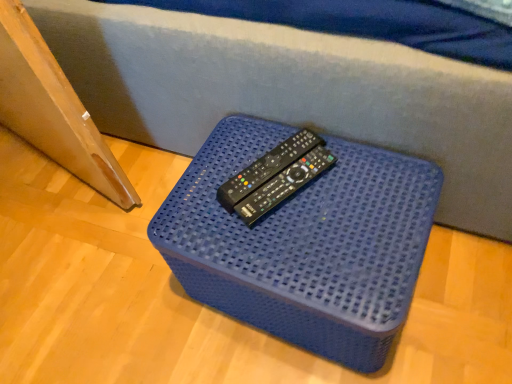
This screenshot has height=384, width=512. In order to click on free space that is to the left of black plastic remote at center in this screenshot , I will do [203, 188].